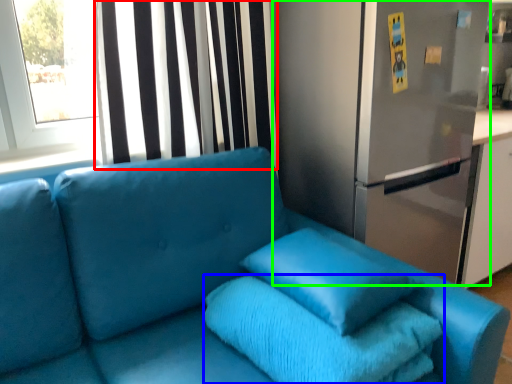
Question: Considering the real-world distances, which object is closest to curtain (highlighted by a red box)? bath towel (highlighted by a blue box) or fridge (highlighted by a green box).

Choices:
 (A) bath towel
 (B) fridge

Answer: (B)